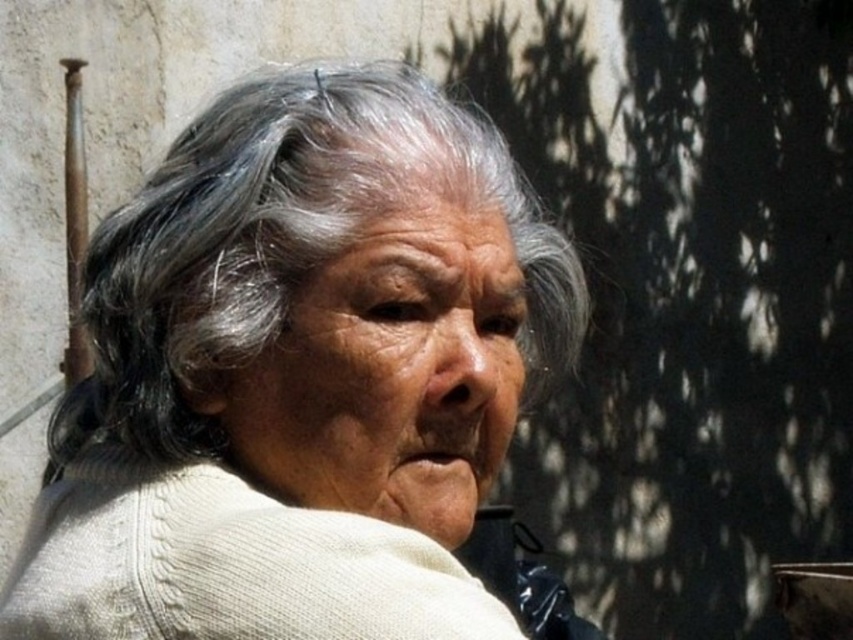
Can you confirm if gray matte hair at center is wider than white knitted sweater at center?

Indeed, gray matte hair at center has a greater width compared to white knitted sweater at center.

From the picture: Can you confirm if gray matte hair at center is positioned below white knitted sweater at center?

No.

Does point (523, 406) come in front of point (71, 483)?

No, it is not.

Where is `gray matte hair at center`? gray matte hair at center is located at coordinates (282, 246).